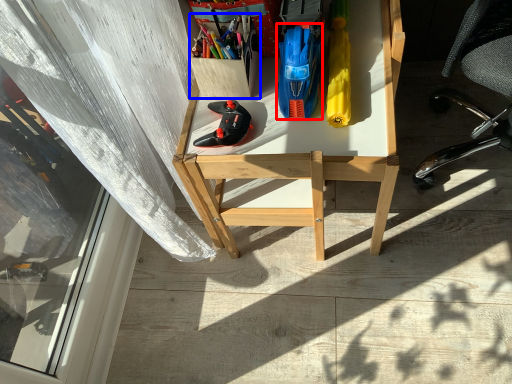
Question: Which object is closer to the camera taking this photo, stationery (highlighted by a red box) or stationery (highlighted by a blue box)?

Choices:
 (A) stationery
 (B) stationery

Answer: (A)